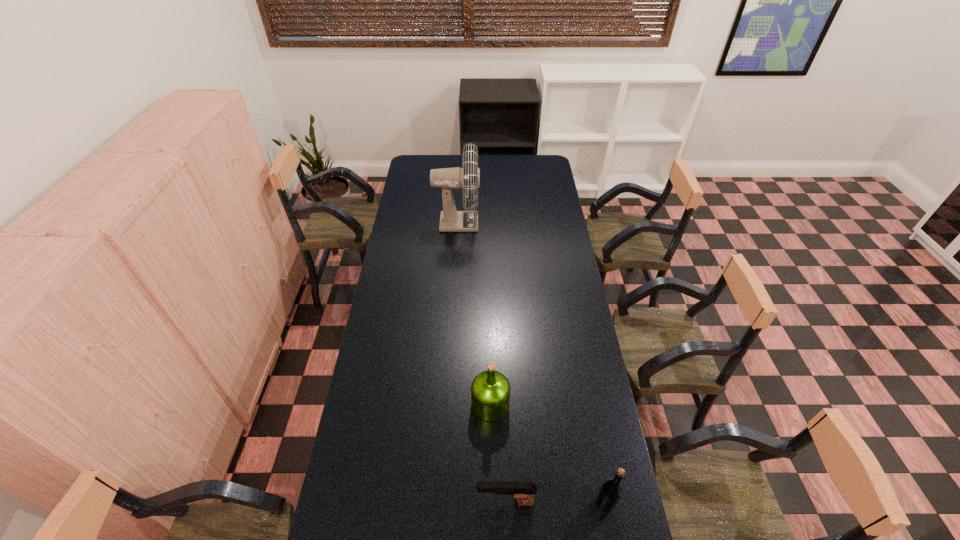
In order to click on unoccupied position between the olive oil and the shortest object in this screenshot , I will do `click(498, 453)`.

You are a GUI agent. You are given a task and a screenshot of the screen. Output one action in this format:
    pyautogui.click(x=<x>, y=<y>)
    Task: Click on the vacant space that is in between the beer bottle and the pistol
    The height and width of the screenshot is (540, 960).
    Given the screenshot: What is the action you would take?
    pyautogui.click(x=555, y=502)

At what (x,y) coordinates should I click in order to perform the action: click on free space between the tallest object and the beer bottle. Please return your answer as a coordinate pair (x, y). The width and height of the screenshot is (960, 540). Looking at the image, I should click on (531, 363).

I want to click on vacant space that's between the third nearest object and the pistol, so click(x=498, y=453).

Image resolution: width=960 pixels, height=540 pixels. Find the location of `free area in between the olive oil and the rightmost object`. free area in between the olive oil and the rightmost object is located at coordinates (547, 454).

This screenshot has width=960, height=540. What are the coordinates of `free space between the second farthest object and the tallest object` in the screenshot? It's located at tap(473, 313).

At what (x,y) coordinates should I click in order to perform the action: click on the third closest object relative to the pistol. Please return your answer as a coordinate pair (x, y). This screenshot has height=540, width=960. Looking at the image, I should click on (446, 178).

At what (x,y) coordinates should I click in order to perform the action: click on object that is the second nearest to the tallest object. Please return your answer as a coordinate pair (x, y). Image resolution: width=960 pixels, height=540 pixels. Looking at the image, I should click on (523, 492).

Where is `free space in the image that satisfies the following two spatial constraints: 1. on the air flow direction of the tallest object; 2. on the left side of the olive oil`? The height and width of the screenshot is (540, 960). free space in the image that satisfies the following two spatial constraints: 1. on the air flow direction of the tallest object; 2. on the left side of the olive oil is located at coordinates (446, 404).

Image resolution: width=960 pixels, height=540 pixels. I want to click on vacant space that satisfies the following two spatial constraints: 1. on the back side of the beer bottle; 2. on the air flow direction of the tallest object, so click(x=552, y=222).